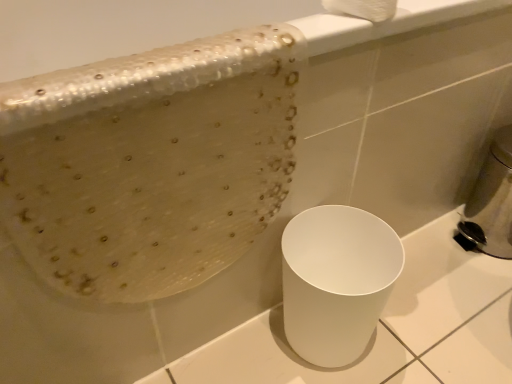
Question: Considering the relative sizes of white glossy trash can at lower right and metallic silver soap dispenser at right in the image provided, is white glossy trash can at lower right wider than metallic silver soap dispenser at right?

Choices:
 (A) no
 (B) yes

Answer: (A)

Question: From a real-world perspective, is white glossy trash can at lower right on top of metallic silver soap dispenser at right?

Choices:
 (A) no
 (B) yes

Answer: (A)

Question: Is white glossy trash can at lower right bigger than metallic silver soap dispenser at right?

Choices:
 (A) no
 (B) yes

Answer: (A)

Question: Could metallic silver soap dispenser at right be considered to be inside white glossy trash can at lower right?

Choices:
 (A) no
 (B) yes

Answer: (A)

Question: Does white glossy trash can at lower right have a lesser height compared to metallic silver soap dispenser at right?

Choices:
 (A) no
 (B) yes

Answer: (B)

Question: Can we say white glossy trash can at lower right lies outside metallic silver soap dispenser at right?

Choices:
 (A) yes
 (B) no

Answer: (A)

Question: Is the position of metallic silver soap dispenser at right less distant than that of white glossy trash can at lower right?

Choices:
 (A) no
 (B) yes

Answer: (A)

Question: Considering the relative sizes of metallic silver soap dispenser at right and white glossy trash can at lower right in the image provided, is metallic silver soap dispenser at right thinner than white glossy trash can at lower right?

Choices:
 (A) yes
 (B) no

Answer: (B)

Question: Is metallic silver soap dispenser at right shorter than white glossy trash can at lower right?

Choices:
 (A) no
 (B) yes

Answer: (A)

Question: Is metallic silver soap dispenser at right directly adjacent to white glossy trash can at lower right?

Choices:
 (A) yes
 (B) no

Answer: (B)

Question: Would you consider metallic silver soap dispenser at right to be distant from white glossy trash can at lower right?

Choices:
 (A) yes
 (B) no

Answer: (B)

Question: Is metallic silver soap dispenser at right at the right side of white glossy trash can at lower right?

Choices:
 (A) yes
 (B) no

Answer: (A)

Question: Is white fluffy toilet paper at upper center completely or partially outside of metallic silver soap dispenser at right?

Choices:
 (A) yes
 (B) no

Answer: (A)